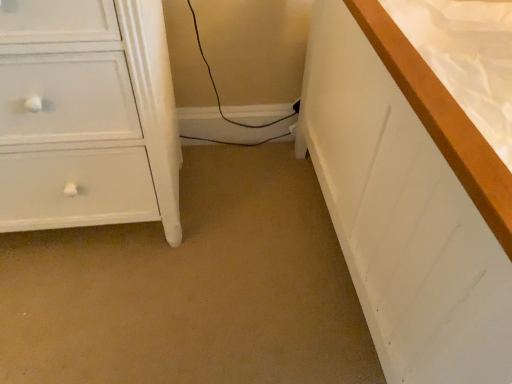
Describe the element at coordinates (87, 116) in the screenshot. I see `white painted wood chest of drawers at left` at that location.

Where is `white painted wood chest of drawers at left`? The image size is (512, 384). white painted wood chest of drawers at left is located at coordinates (87, 116).

What is the approximate height of white painted wood chest of drawers at left?

28.58 inches.

The image size is (512, 384). I want to click on white wood bed at right, so click(x=409, y=200).

Describe the element at coordinates (409, 200) in the screenshot. This screenshot has height=384, width=512. I see `white wood bed at right` at that location.

Where is `white painted wood chest of drawers at left`? This screenshot has width=512, height=384. white painted wood chest of drawers at left is located at coordinates (87, 116).

Between white painted wood chest of drawers at left and white wood bed at right, which one appears on the right side from the viewer's perspective?

From the viewer's perspective, white wood bed at right appears more on the right side.

Which object is further away from the camera, white painted wood chest of drawers at left or white wood bed at right?

white painted wood chest of drawers at left is further from the camera.

Which is less distant, (129, 142) or (450, 289)?

The point (450, 289) is closer.

From the image's perspective, is white painted wood chest of drawers at left positioned above or below white wood bed at right?

Based on their image positions, white painted wood chest of drawers at left is located above white wood bed at right.

In the scene shown: From a real-world perspective, is white painted wood chest of drawers at left physically below white wood bed at right?

Yes, from a real-world perspective, white painted wood chest of drawers at left is below white wood bed at right.

Can you confirm if white painted wood chest of drawers at left is wider than white wood bed at right?

No.

In the scene shown: In terms of height, does white painted wood chest of drawers at left look taller or shorter compared to white wood bed at right?

In the image, white painted wood chest of drawers at left appears to be shorter than white wood bed at right.

Can you confirm if white painted wood chest of drawers at left is bigger than white wood bed at right?

Incorrect, white painted wood chest of drawers at left is not larger than white wood bed at right.

Is white painted wood chest of drawers at left inside or outside of white wood bed at right?

white painted wood chest of drawers at left lies outside white wood bed at right.

Is white painted wood chest of drawers at left with white wood bed at right?

No, white painted wood chest of drawers at left is not making contact with white wood bed at right.

Is white painted wood chest of drawers at left oriented towards white wood bed at right?

No, white painted wood chest of drawers at left is not aimed at white wood bed at right.

Looking at this image, can you tell me how much white painted wood chest of drawers at left and white wood bed at right differ in facing direction?

There is a 89.9-degree angle between the facing directions of white painted wood chest of drawers at left and white wood bed at right.

Where is `counter top that is below the white painted wood chest of drawers at left (from the image's perspective)`? Image resolution: width=512 pixels, height=384 pixels. counter top that is below the white painted wood chest of drawers at left (from the image's perspective) is located at coordinates (409, 200).

Between white wood bed at right and white painted wood chest of drawers at left, which one appears on the left side from the viewer's perspective?

Positioned to the left is white painted wood chest of drawers at left.

Based on the photo, is white wood bed at right closer to camera compared to white painted wood chest of drawers at left?

Yes, it is.

Between point (313, 137) and point (8, 49), which one is positioned behind?

Point (313, 137)

From the image's perspective, is white wood bed at right on top of white painted wood chest of drawers at left?

No, from the image's perspective, white wood bed at right is not over white painted wood chest of drawers at left.

From a real-world perspective, which is physically below, white wood bed at right or white painted wood chest of drawers at left?

white painted wood chest of drawers at left, from a real-world perspective.

Between white wood bed at right and white painted wood chest of drawers at left, which one has larger width?

Wider between the two is white wood bed at right.

From the picture: Is white wood bed at right taller or shorter than white painted wood chest of drawers at left?

Considering their sizes, white wood bed at right has more height than white painted wood chest of drawers at left.

Which of these two, white wood bed at right or white painted wood chest of drawers at left, is smaller?

With smaller size is white painted wood chest of drawers at left.

Is white wood bed at right positioned beyond the bounds of white painted wood chest of drawers at left?

white wood bed at right is positioned outside white painted wood chest of drawers at left.

Is white wood bed at right with white painted wood chest of drawers at left?

They are not placed beside each other.

Is white painted wood chest of drawers at left at the back of white wood bed at right?

white wood bed at right is not turned away from white painted wood chest of drawers at left.

Can you tell me how much white wood bed at right and white painted wood chest of drawers at left differ in facing direction?

white wood bed at right and white painted wood chest of drawers at left are facing 89.9 degrees away from each other.

Image resolution: width=512 pixels, height=384 pixels. Find the location of `counter top lying in front of the white painted wood chest of drawers at left`. counter top lying in front of the white painted wood chest of drawers at left is located at coordinates (409, 200).

You are a GUI agent. You are given a task and a screenshot of the screen. Output one action in this format:
    pyautogui.click(x=<x>, y=<y>)
    Task: Click on the counter top that is below the white painted wood chest of drawers at left (from the image's perspective)
    Image resolution: width=512 pixels, height=384 pixels.
    Given the screenshot: What is the action you would take?
    pyautogui.click(x=409, y=200)

This screenshot has height=384, width=512. In order to click on counter top that appears in front of the white painted wood chest of drawers at left in this screenshot , I will do `click(409, 200)`.